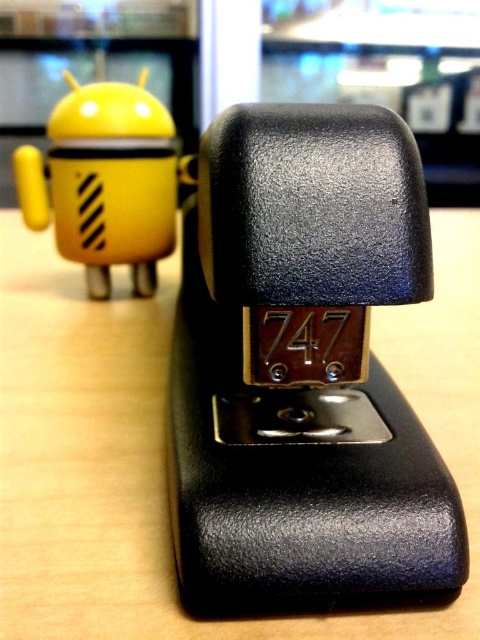
Is black matte stapler at center positioned at the back of yellow matte android at left?

No, black matte stapler at center is in front of yellow matte android at left.

Which is behind, point (233, 410) or point (20, 173)?

The point (20, 173) is more distant.

Image resolution: width=480 pixels, height=640 pixels. I want to click on black matte stapler at center, so click(x=302, y=368).